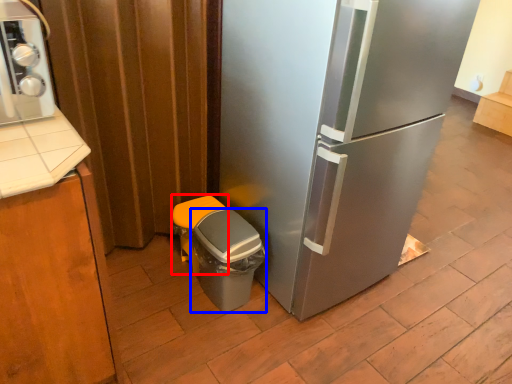
Question: Which object appears farthest to the camera in this image, garbage (highlighted by a red box) or potty (highlighted by a blue box)?

Choices:
 (A) garbage
 (B) potty

Answer: (A)